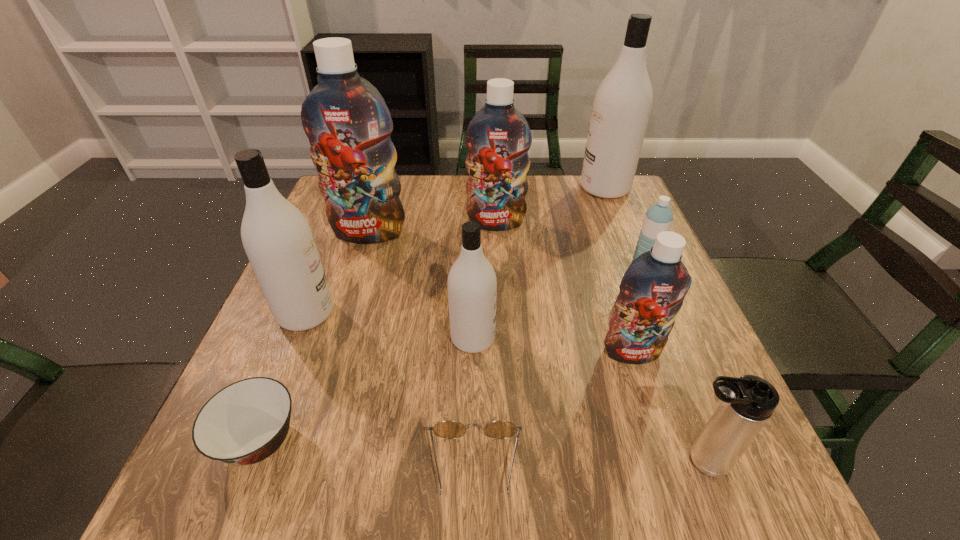
In order to click on thermos bottle in this screenshot , I will do `click(745, 405)`.

At what (x,y) coordinates should I click in order to perform the action: click on soup bowl. Please return your answer as a coordinate pair (x, y). The image size is (960, 540). Looking at the image, I should click on (244, 423).

What are the coordinates of `the shortest object` in the screenshot? It's located at (448, 429).

Locate an element on the screen. This screenshot has height=540, width=960. spectacles is located at coordinates (448, 429).

In order to click on vacant space located 0.160m on the front-facing side of the rightmost white shampoo in this screenshot , I will do `click(525, 188)`.

The width and height of the screenshot is (960, 540). What are the coordinates of `free region located on the front-facing side of the rightmost white shampoo` in the screenshot? It's located at (532, 188).

The image size is (960, 540). Identify the location of vacant space located 0.100m on the front-facing side of the rightmost white shampoo. pyautogui.click(x=545, y=188).

This screenshot has height=540, width=960. I want to click on vacant area located on the front label of the biggest blue shampoo, so click(340, 327).

Where is `free spot located 0.160m on the front-facing side of the leftmost white shampoo`? free spot located 0.160m on the front-facing side of the leftmost white shampoo is located at coordinates (411, 313).

At what (x,y) coordinates should I click in order to perform the action: click on vacant space located on the front label of the second smallest blue shampoo. Please return your answer as a coordinate pair (x, y). This screenshot has width=960, height=540. Looking at the image, I should click on (498, 265).